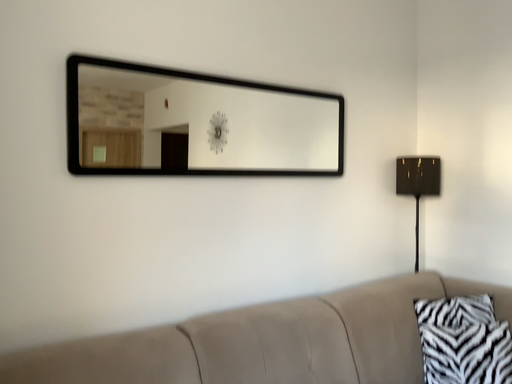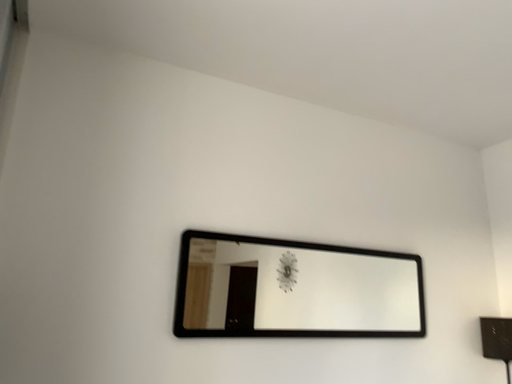
Question: How did the camera likely rotate when shooting the video?

Choices:
 (A) rotated upward
 (B) rotated downward

Answer: (A)